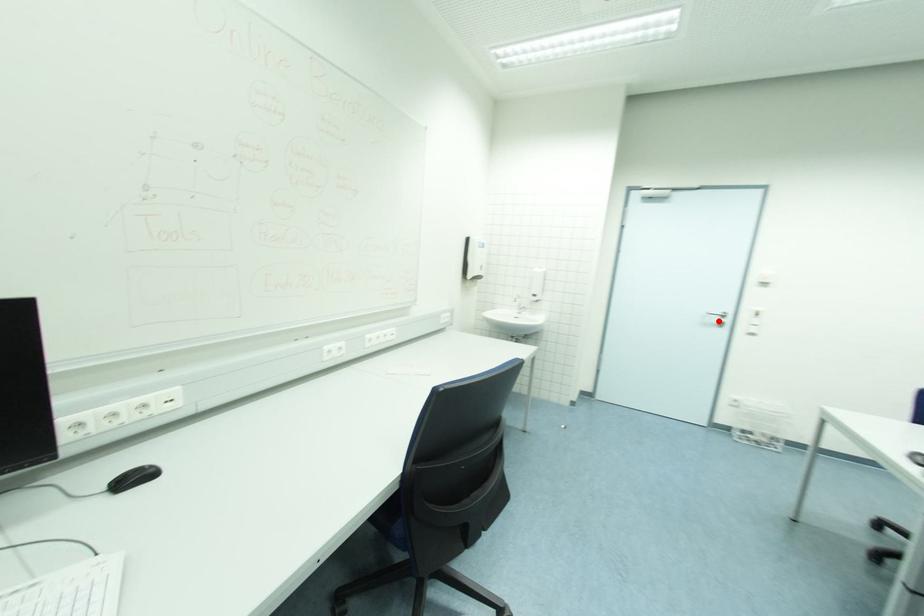
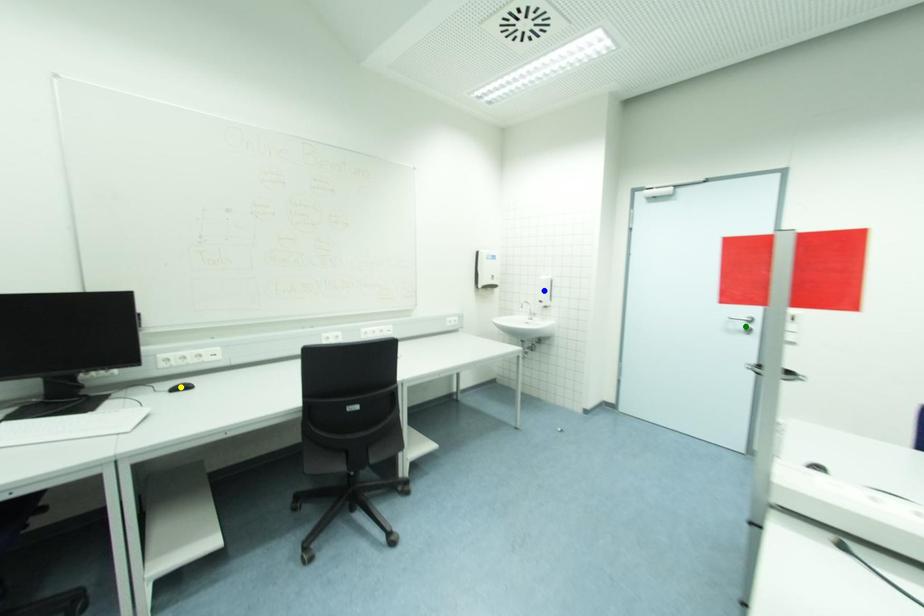
Question: I am providing you with two images of the same scene from different viewpoints. A red point is marked on the first image. You are given multiple points on the second image. Which spot in image 2 lines up with the point in image 1?

Choices:
 (A) blue point
 (B) green point
 (C) yellow point

Answer: (B)